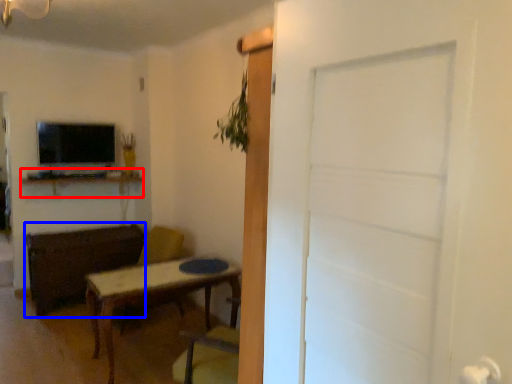
Question: Which object appears farthest to the camera in this image, computer desk (highlighted by a red box) or brown (highlighted by a blue box)?

Choices:
 (A) computer desk
 (B) brown

Answer: (A)